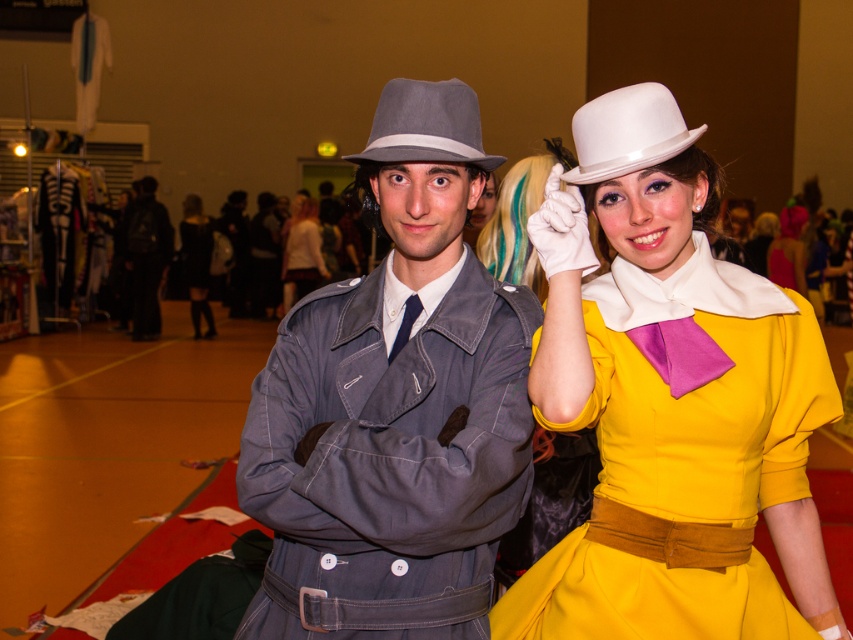
You are organizing a photoshoot and need to arrange the yellow satin dress at center and the white satin blouse at center in a display case. The display case can only accommodate items that take up the same amount of space. Based on the image, can both items be placed in the display case together?

The yellow satin dress at center occupies less space than the white satin blouse at center, so they do not take up the same amount of space. Therefore, they cannot both be placed in the display case together.

You are a photographer at a convention hall. You need to position a camera to capture both the matte gray hat at center and the yellow satin dress at center in the same frame. Based on their heights, which object should be placed closer to the camera to ensure both are fully visible?

The matte gray hat at center is taller than the yellow satin dress at center, so to ensure both are fully visible in the frame, the yellow satin dress at center should be placed closer to the camera while the matte gray hat at center is positioned slightly further back.